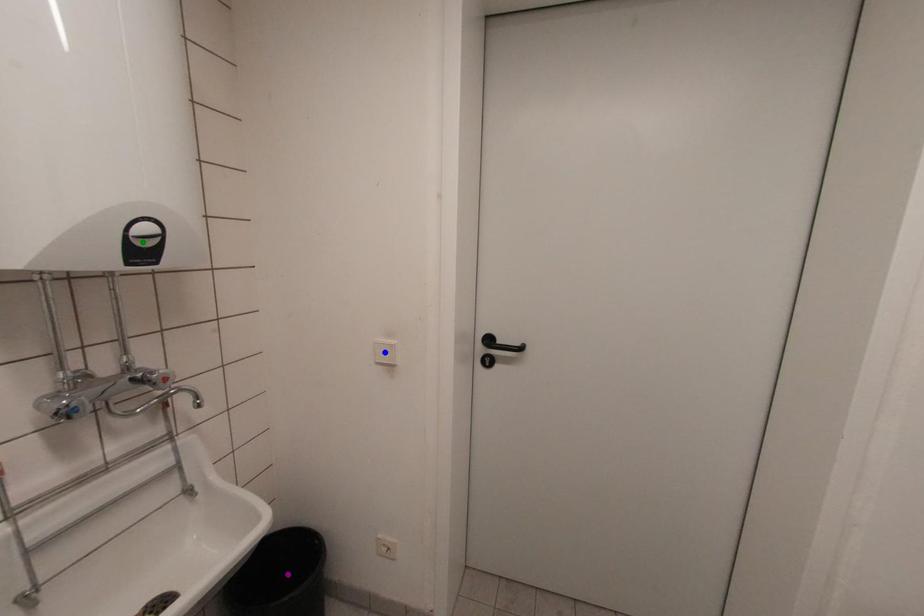
Order these from nearest to farthest:
- purple point
- blue point
- green point

green point → blue point → purple point